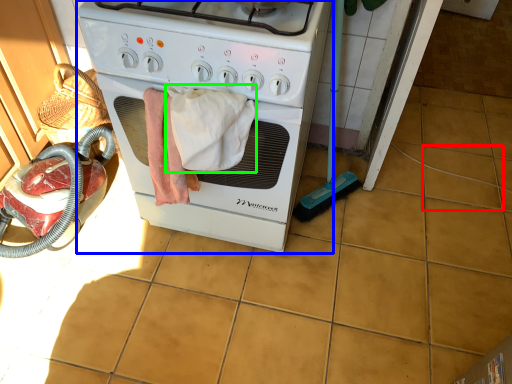
Question: Estimate the real-world distances between objects in this image. Which object is farther from tile (highlighted by a red box), home appliance (highlighted by a blue box) or bath towel (highlighted by a green box)?

Choices:
 (A) home appliance
 (B) bath towel

Answer: (B)